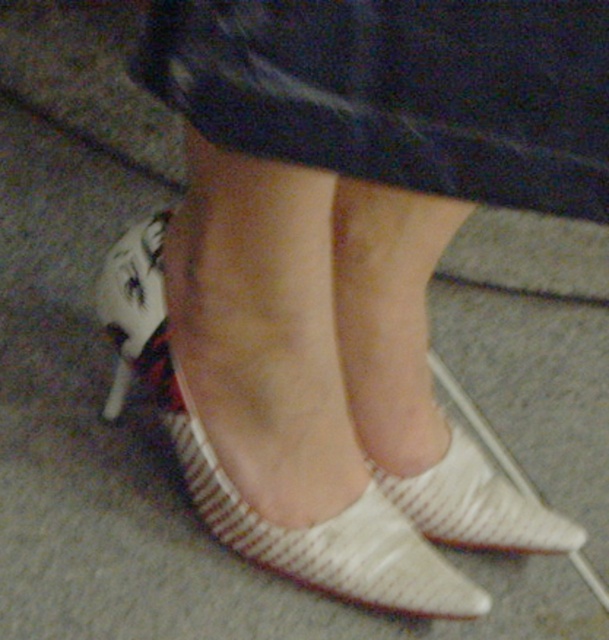
You are a fashion designer observing a model wearing the white textured dress at center and white textured shoe at center. Which item has a shorter height?

The white textured dress at center has a lesser height compared to the white textured shoe at center, so the dress is shorter in height.

You are a fashion designer observing the image. You need to determine the spatial relationship between the white textured dress at center and the white textured sandal at lower center. Which one is positioned higher?

The white textured dress at center is above the white textured sandal at lower center, so the white textured dress at center is positioned higher.

You are trying to untangle a white cable that is in front of your feet. You need to move either the white textured sandal at lower center or the white textured shoe at center out of the way. Which object is closer to the cable?

The white textured sandal at lower center is closer to the cable because it is positioned to the left of the white textured shoe at center, which is further away.